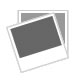
You are a GUI agent. You are given a task and a screenshot of the screen. Output one action in this format:
    pyautogui.click(x=<x>, y=<y>)
    Task: Click on the poloroid pictures
    The height and width of the screenshot is (80, 80).
    Given the screenshot: What is the action you would take?
    pyautogui.click(x=45, y=32), pyautogui.click(x=60, y=21)